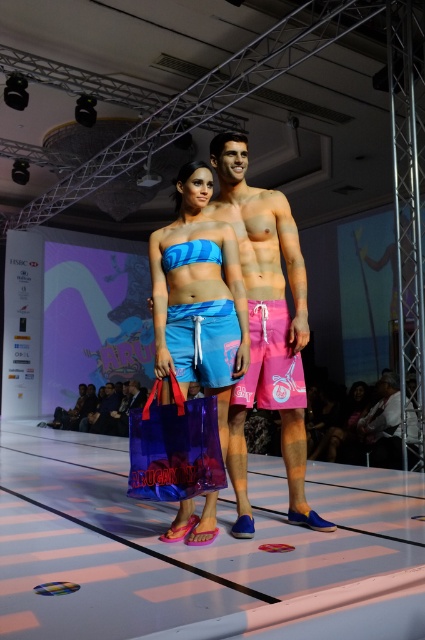
In the fashion show scene, you see the blue matte swimsuit at center and the transparent purple shopping bag at center. Which object is positioned higher in the image?

The blue matte swimsuit at center is above the transparent purple shopping bag at center, so it is positioned higher in the image.

You are a fashion designer observing the runway show. You need to decide which garment has a wider silhouette between the blue matte swimsuit at center and the pink fabric shorts at right. Which one is wider?

The blue matte swimsuit at center is wider than the pink fabric shorts at right according to the description.

You are a photographer at the runway show and need to capture a clear shot of both the pink matte swim shorts at center and the pink fabric shorts at right. However, the lighting is such that only the topmost item can be properly illuminated. Which pair of shorts should you focus on to ensure the best visibility?

The pink matte swim shorts at center is positioned over pink fabric shorts at right, so focusing on the pink matte swim shorts at center will ensure better visibility as it is the topmost item under the lighting conditions.